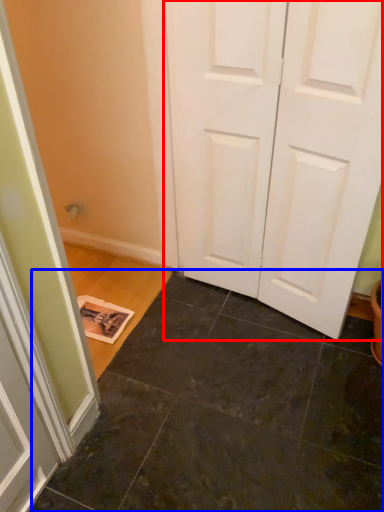
Question: Among these objects, which one is farthest to the camera, door (highlighted by a red box) or tile (highlighted by a blue box)?

Choices:
 (A) door
 (B) tile

Answer: (A)